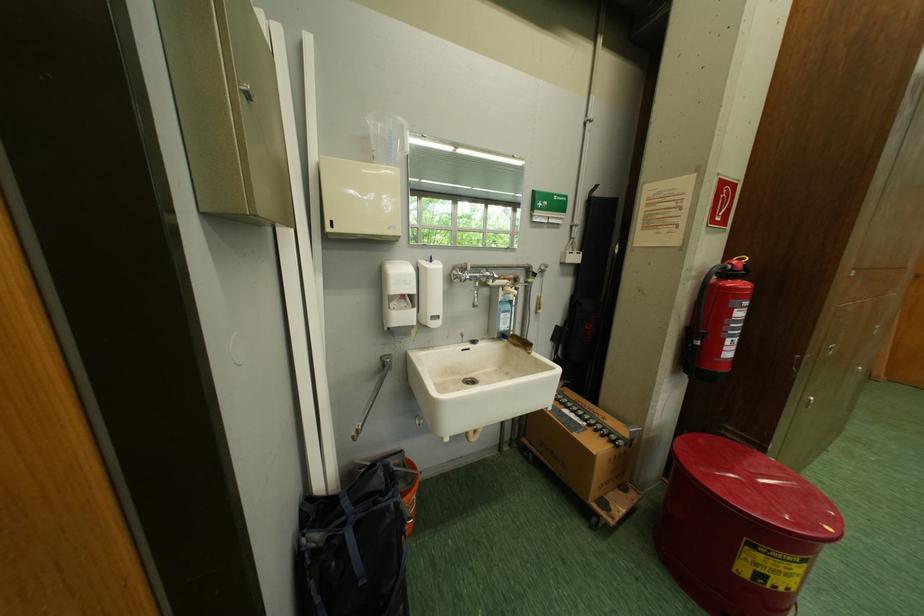
Find the location of a particular element. Image resolution: width=924 pixels, height=616 pixels. metal cabinet lock is located at coordinates (246, 91).